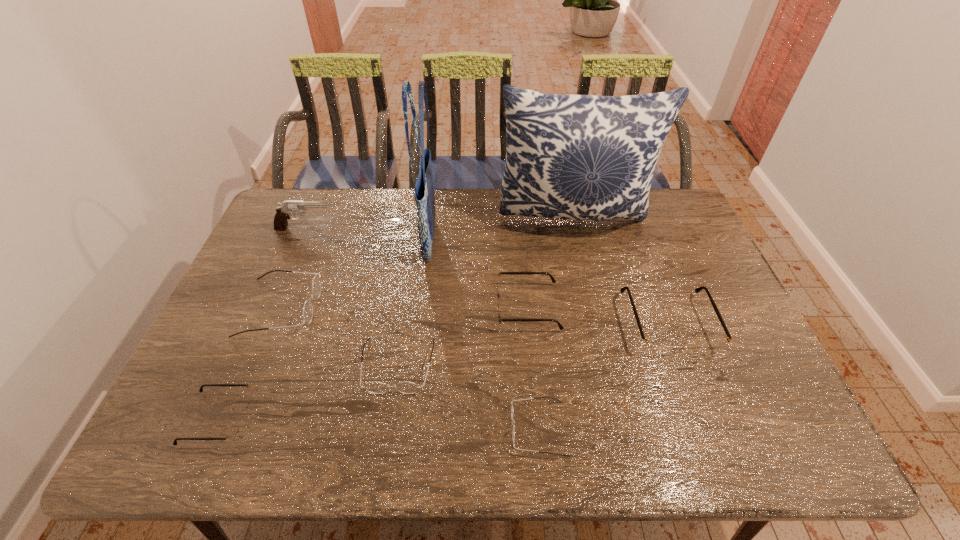
Identify the location of vacant space located 0.110m at the hinge ends of the second black spectacles from left to right. (456, 307).

Where is `vacant space situated 0.080m through the lenses of the second smallest dark spectacles`? The image size is (960, 540). vacant space situated 0.080m through the lenses of the second smallest dark spectacles is located at coordinates (389, 427).

Locate an element on the screen. The width and height of the screenshot is (960, 540). free space located 0.060m at the hinge ends of the leftmost black spectacles is located at coordinates (274, 419).

Locate an element on the screen. This screenshot has width=960, height=540. free region located 0.360m through the lenses of the nearest dark spectacles is located at coordinates (352, 428).

Find the location of a particular element. This screenshot has height=540, width=960. vacant space located through the lenses of the nearest dark spectacles is located at coordinates (366, 428).

What are the coordinates of `vacant area located 0.120m through the lenses of the nearest dark spectacles` in the screenshot? It's located at (458, 428).

Identify the location of shopping bag located at the far edge. (424, 190).

I want to click on cushion situated at the far edge, so click(580, 157).

Find the location of a particular element. gun that is positioned at the far edge is located at coordinates (283, 212).

Image resolution: width=960 pixels, height=540 pixels. What are the coordinates of `gun positioned at the left edge` in the screenshot? It's located at (283, 212).